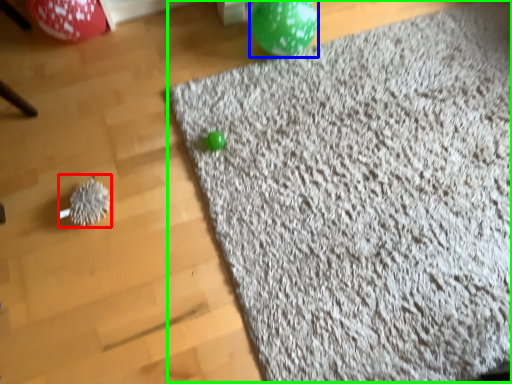
Question: Considering the real-world distances, which object is farthest from toy (highlighted by a red box)? balloon (highlighted by a blue box) or mat (highlighted by a green box)?

Choices:
 (A) balloon
 (B) mat

Answer: (A)